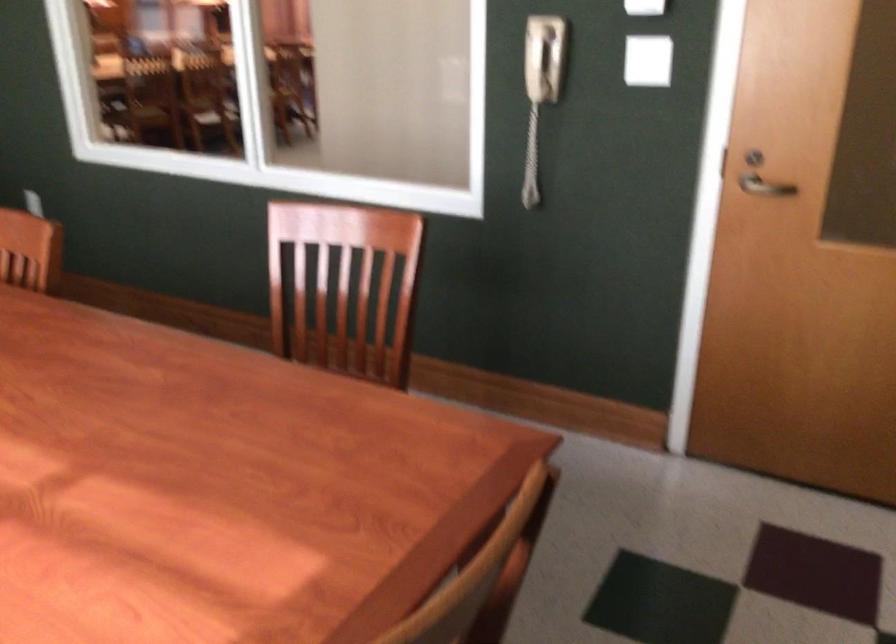
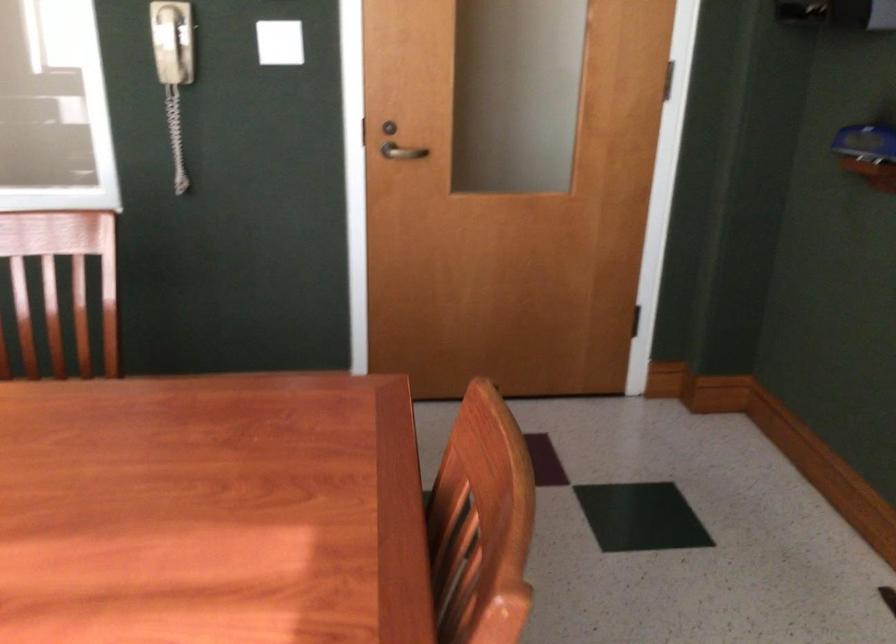
Find the pixel in the second image that matches pixel 763 187 in the first image.

(401, 152)